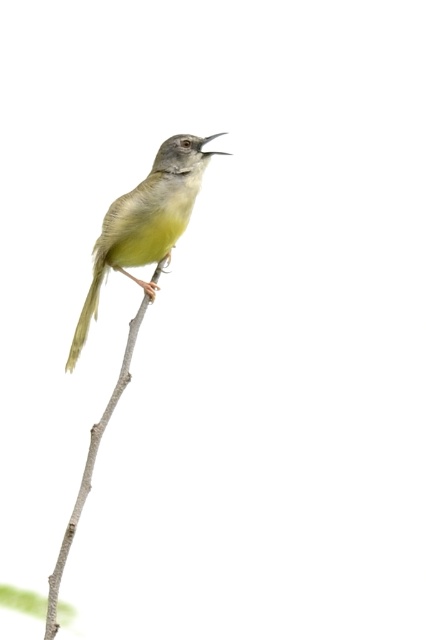
Question: Which of the following is the closest to the observer?

Choices:
 (A) (89, 449)
 (B) (169, 147)

Answer: (A)

Question: Which point appears closest to the camera in this image?

Choices:
 (A) (71, 516)
 (B) (180, 228)

Answer: (A)

Question: Does yellow-green feathers at center appear on the right side of smooth gray branch at center?

Choices:
 (A) no
 (B) yes

Answer: (B)

Question: Is yellow-green feathers at center to the left of smooth gray branch at center from the viewer's perspective?

Choices:
 (A) yes
 (B) no

Answer: (B)

Question: Can you confirm if yellow-green feathers at center is smaller than smooth gray branch at center?

Choices:
 (A) no
 (B) yes

Answer: (B)

Question: Which of the following is the closest to the observer?

Choices:
 (A) (178, 200)
 (B) (158, 273)

Answer: (A)